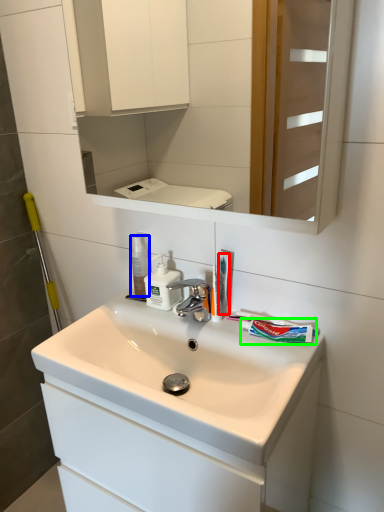
Question: Which is farther away from toothbrush (highlighted by a red box)? mouthwash (highlighted by a blue box) or toothpaste (highlighted by a green box)?

Choices:
 (A) mouthwash
 (B) toothpaste

Answer: (A)